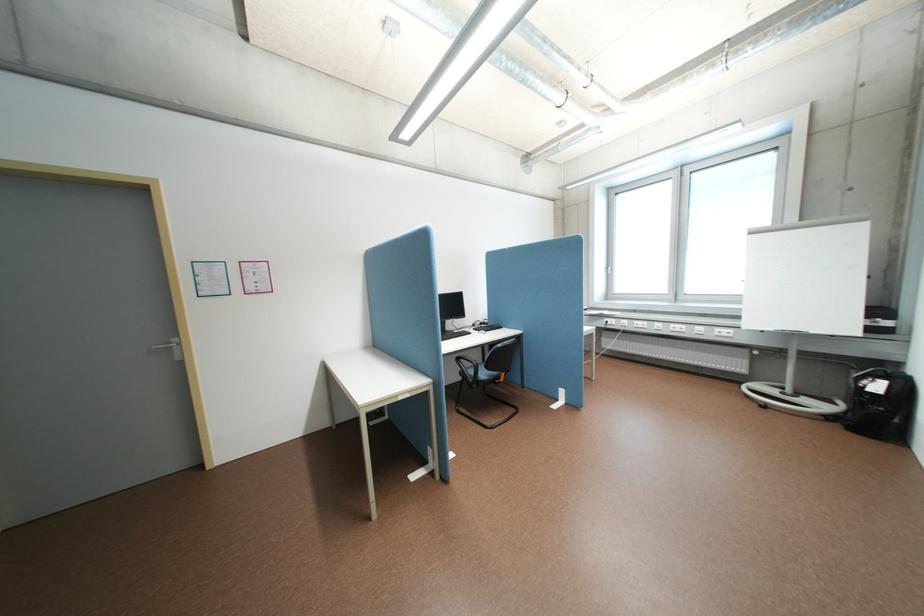
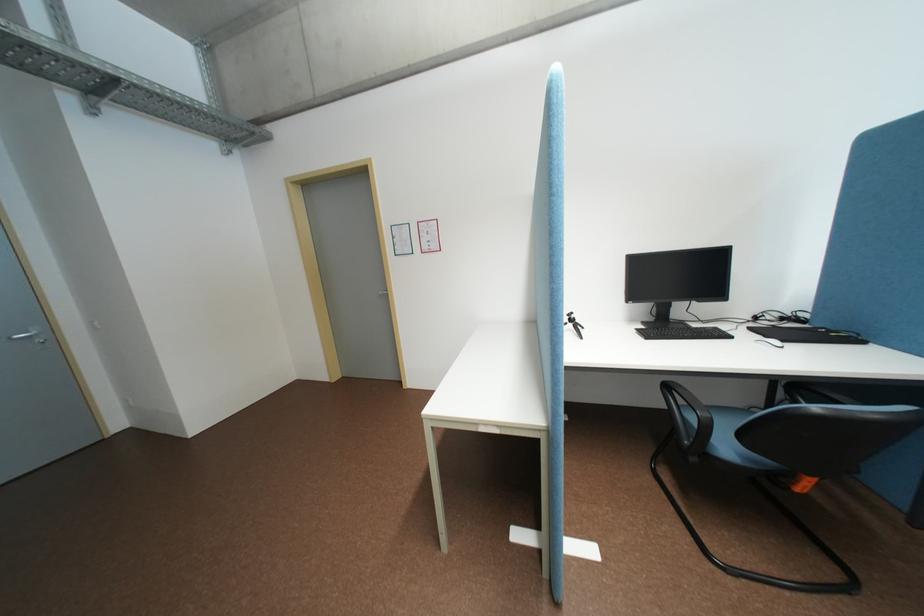
Question: The camera is either moving clockwise (left) or counter-clockwise (right) around the object. The first image is from the beginning of the video and the second image is from the end. Is the camera moving left or right when shooting the video?

Choices:
 (A) Left
 (B) Right

Answer: (B)